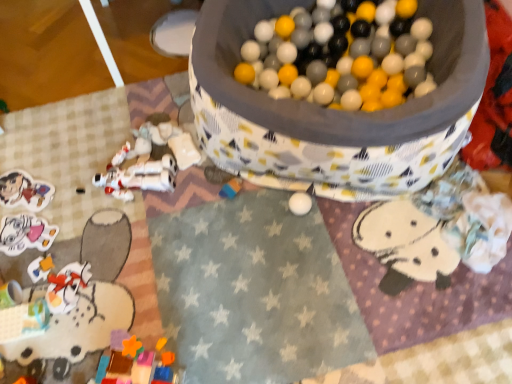
Identify the location of space that is in front of matte cardboard sticker at lower left, which is the sixth toy from right to left. (27, 241).